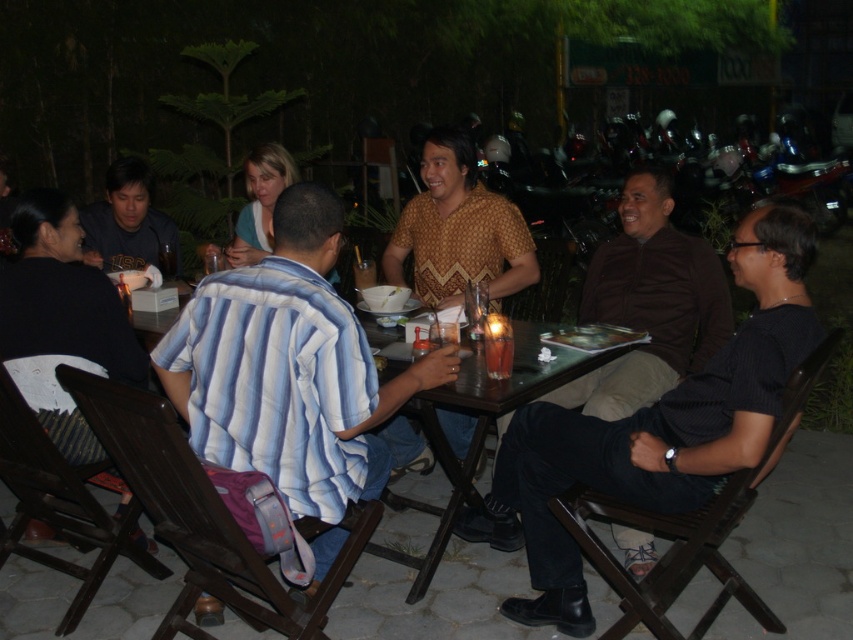
Is point (372, 401) farther from viewer compared to point (495, 358)?

No, it is not.

Is blue striped shirt at center thinner than translucent plastic cup at table center?

No, blue striped shirt at center is not thinner than translucent plastic cup at table center.

I want to click on blue striped shirt at center, so click(292, 371).

The image size is (853, 640). I want to click on blue striped shirt at center, so click(x=292, y=371).

Does dark brown shirt at center appear on the right side of matte black shirt at left?

Indeed, dark brown shirt at center is positioned on the right side of matte black shirt at left.

Is point (503, 413) farther from camera compared to point (109, 225)?

No, (503, 413) is in front of (109, 225).

Measure the distance between dark brown shirt at center and camera.

dark brown shirt at center is 2.73 meters from camera.

Image resolution: width=853 pixels, height=640 pixels. Find the location of `dark brown shirt at center`. dark brown shirt at center is located at coordinates (648, 304).

From the picture: Which of these two, blue striped shirt at center or translucent glass cup at center, stands shorter?

translucent glass cup at center is shorter.

Does blue striped shirt at center appear under translucent glass cup at center?

Indeed, blue striped shirt at center is positioned under translucent glass cup at center.

Who is more forward, (x=326, y=324) or (x=361, y=278)?

Point (x=326, y=324)

What are the coordinates of `blue striped shirt at center` in the screenshot? It's located at tap(292, 371).